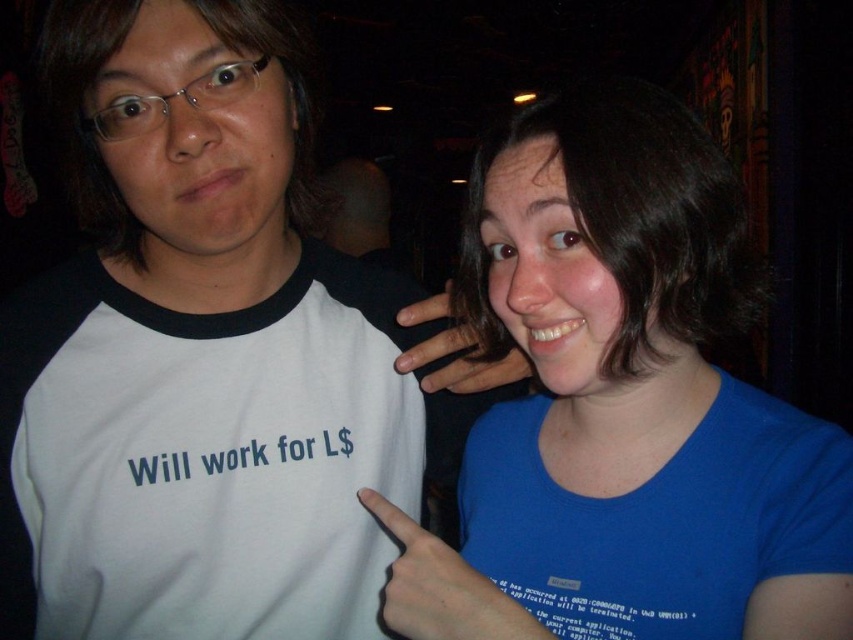
Is white fabric t-shirt at left positioned in front of matte skin hand at center?

Yes, it is in front of matte skin hand at center.

Does white fabric t-shirt at left come behind matte skin hand at center?

No, it is not.

Is point (364, 424) positioned before point (410, 317)?

No, (364, 424) is behind (410, 317).

This screenshot has width=853, height=640. I want to click on white fabric t-shirt at left, so click(x=202, y=456).

You are a GUI agent. You are given a task and a screenshot of the screen. Output one action in this format:
    pyautogui.click(x=<x>, y=<y>)
    Task: Click on the blue cotton shirt at right
    This screenshot has height=640, width=853.
    Given the screenshot: What is the action you would take?
    pyautogui.click(x=624, y=404)

Is blue cotton shirt at right closer to the viewer compared to matte skin hand at center?

Yes.

Describe the element at coordinates (624, 404) in the screenshot. This screenshot has width=853, height=640. I see `blue cotton shirt at right` at that location.

The image size is (853, 640). I want to click on blue cotton shirt at right, so click(x=624, y=404).

Based on the photo, can you confirm if blue cotton shirt at right is taller than blue fabric hand at center?

Indeed, blue cotton shirt at right has a greater height compared to blue fabric hand at center.

Is blue cotton shirt at right below blue fabric hand at center?

Incorrect, blue cotton shirt at right is not positioned below blue fabric hand at center.

Locate an element on the screen. blue cotton shirt at right is located at coordinates (624, 404).